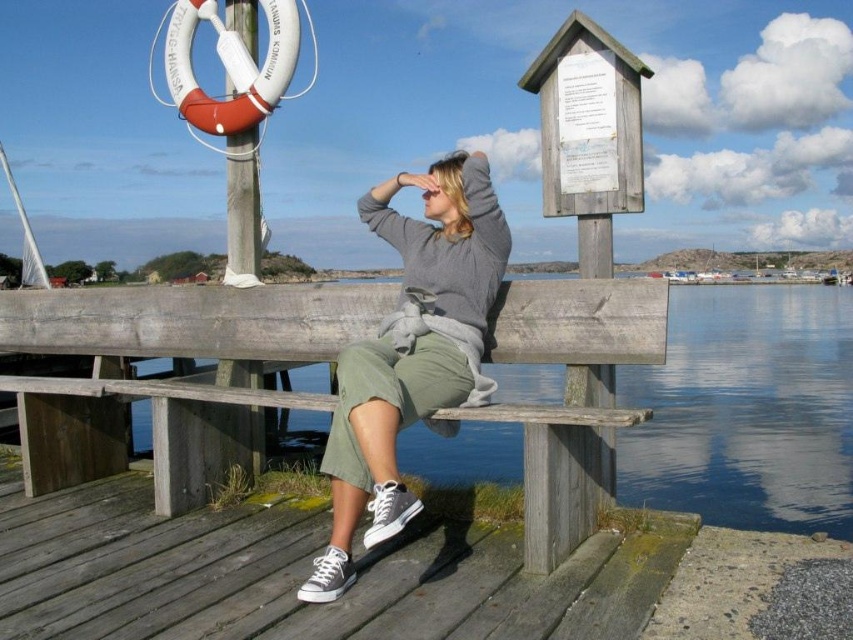
Question: Is transparent blue water at lower center to the left of gray cotton sweater at center from the viewer's perspective?

Choices:
 (A) no
 (B) yes

Answer: (A)

Question: Among these points, which one is nearest to the camera?

Choices:
 (A) (695, 312)
 (B) (376, 449)

Answer: (B)

Question: Is transparent blue water at lower center bigger than gray cotton sweater at center?

Choices:
 (A) no
 (B) yes

Answer: (B)

Question: Which point is farther to the camera?

Choices:
 (A) (799, 433)
 (B) (376, 419)

Answer: (A)

Question: Can you confirm if transparent blue water at lower center is positioned to the right of gray cotton sweater at center?

Choices:
 (A) no
 (B) yes

Answer: (B)